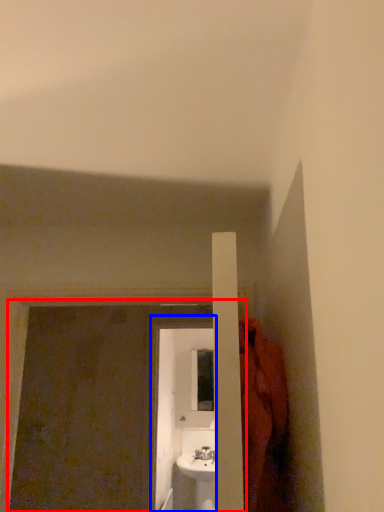
Question: Which object is further to the camera taking this photo, screen door (highlighted by a red box) or screen door (highlighted by a blue box)?

Choices:
 (A) screen door
 (B) screen door

Answer: (B)